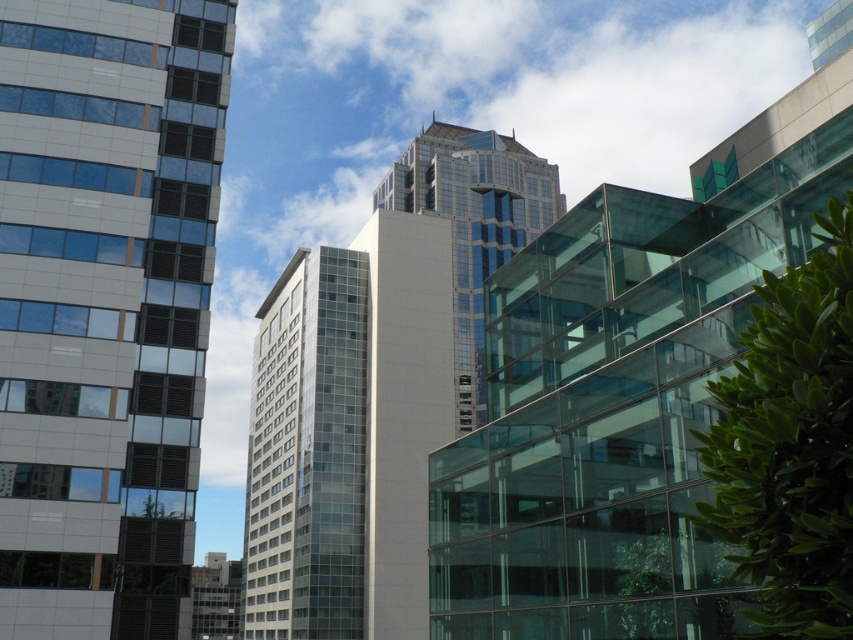
You are an urban planner assessing building dimensions. Given the white glass building at left and the glassy reflective skyscraper at center, which one has a greater width?

The glassy reflective skyscraper at center has a greater width than the white glass building at left.

You are standing in the middle of the city and see the point marked at coordinates (103,305). Which building does this point correspond to?

The point at coordinates (103,305) corresponds to the white glass building at left.